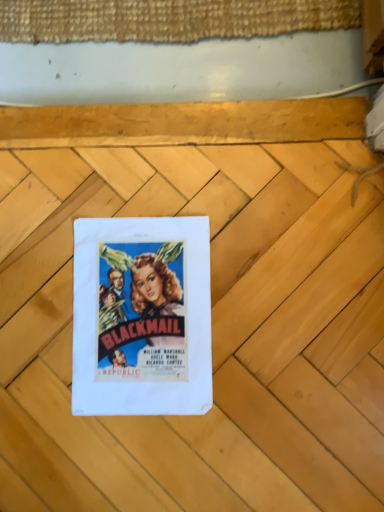
Where is `vacant space situated above matte paper poster at center (from a real-world perspective)`? This screenshot has width=384, height=512. vacant space situated above matte paper poster at center (from a real-world perspective) is located at coordinates (130, 314).